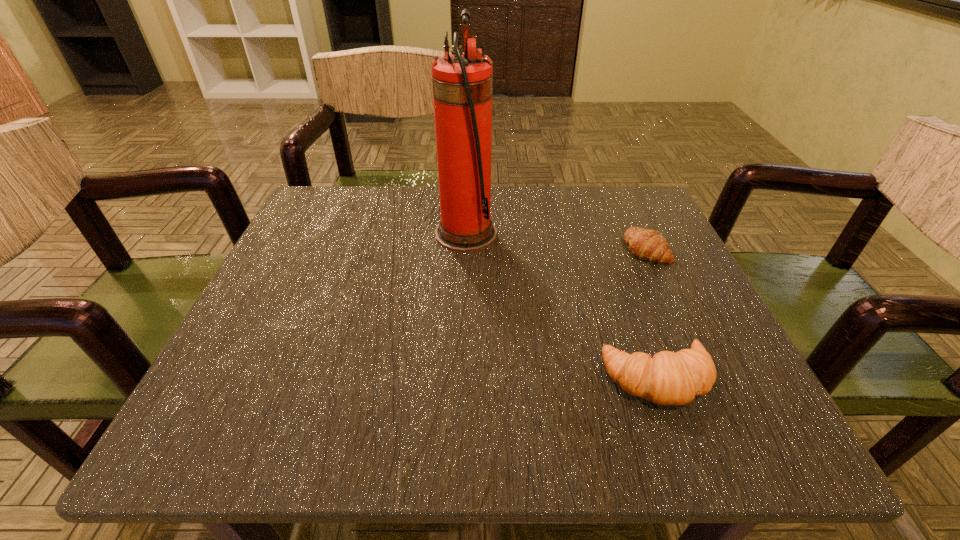
Where is `crescent roll situated at the far edge`? This screenshot has height=540, width=960. crescent roll situated at the far edge is located at coordinates (645, 244).

This screenshot has height=540, width=960. Find the location of `object at the near edge`. object at the near edge is located at coordinates (669, 378).

Locate an element on the screen. object that is at the far right corner is located at coordinates (645, 244).

In order to click on object that is at the near right corner in this screenshot , I will do `click(669, 378)`.

Image resolution: width=960 pixels, height=540 pixels. I want to click on vacant area at the far edge, so point(397,203).

This screenshot has width=960, height=540. Find the location of `vacant position at the near edge of the desktop`. vacant position at the near edge of the desktop is located at coordinates tap(467, 405).

What are the coordinates of `free space at the left edge` in the screenshot? It's located at (324, 380).

You are a GUI agent. You are given a task and a screenshot of the screen. Output one action in this format:
    pyautogui.click(x=<x>, y=<y>)
    Task: Click on the vacant space at the right edge of the desktop
    
    Given the screenshot: What is the action you would take?
    pyautogui.click(x=633, y=268)

In the image, there is a desktop. Identify the location of free region at the far left corner. The width and height of the screenshot is (960, 540). (355, 227).

The height and width of the screenshot is (540, 960). I want to click on vacant space at the near left corner of the desktop, so click(246, 408).